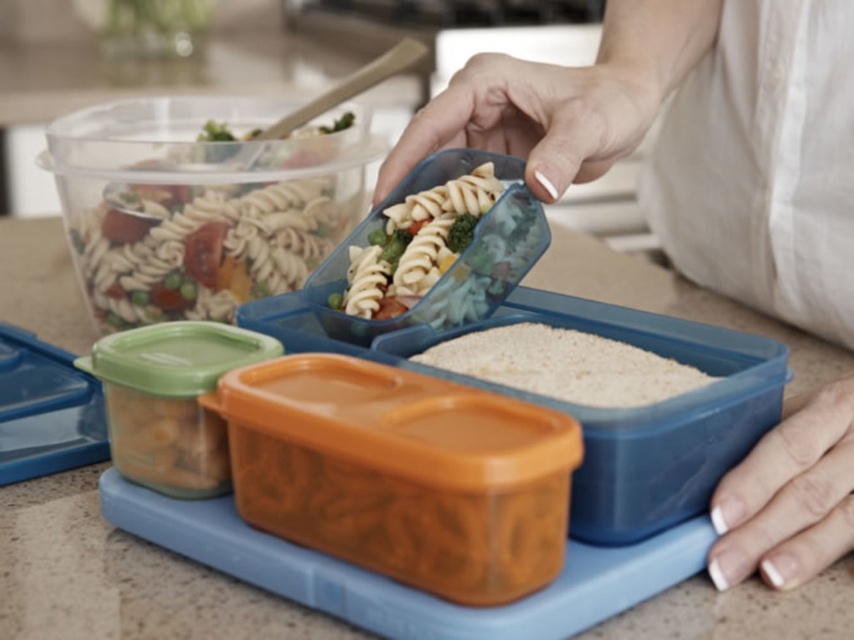
Is white matte hand at upper center positioned before white matte rice at center?

No, it is not.

The height and width of the screenshot is (640, 854). Identify the location of white matte hand at upper center. (689, 140).

The height and width of the screenshot is (640, 854). What are the coordinates of `white matte hand at upper center` in the screenshot? It's located at (689, 140).

Is point (702, 378) positioned after point (489, 163)?

No, it is not.

What do you see at coordinates (564, 365) in the screenshot? I see `white matte rice at center` at bounding box center [564, 365].

Locate an element on the screen. Image resolution: width=854 pixels, height=640 pixels. white matte rice at center is located at coordinates (564, 365).

Where is `white matte rice at center`? The image size is (854, 640). white matte rice at center is located at coordinates (564, 365).

Is point (630, 35) positioned behind point (414, 244)?

Yes, it is.

Is white matte hand at upper center thinner than translucent plastic pasta at center?

No, white matte hand at upper center is not thinner than translucent plastic pasta at center.

At what (x,y) coordinates should I click in order to perform the action: click on white matte hand at upper center. Please return your answer as a coordinate pair (x, y). Looking at the image, I should click on (689, 140).